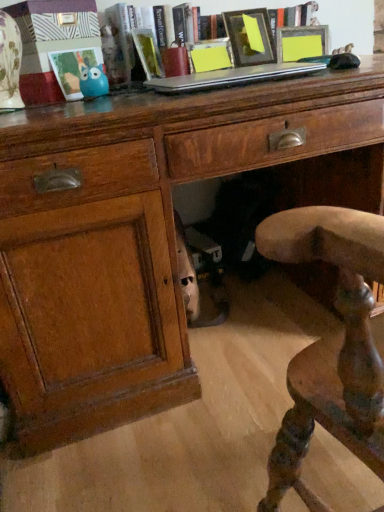
You are a GUI agent. You are given a task and a screenshot of the screen. Output one action in this format:
    pyautogui.click(x=<x>, y=<y>)
    Task: Click on the free space in front of silver metallic laptop at upper center
    The height and width of the screenshot is (512, 384).
    Given the screenshot: What is the action you would take?
    pyautogui.click(x=211, y=93)